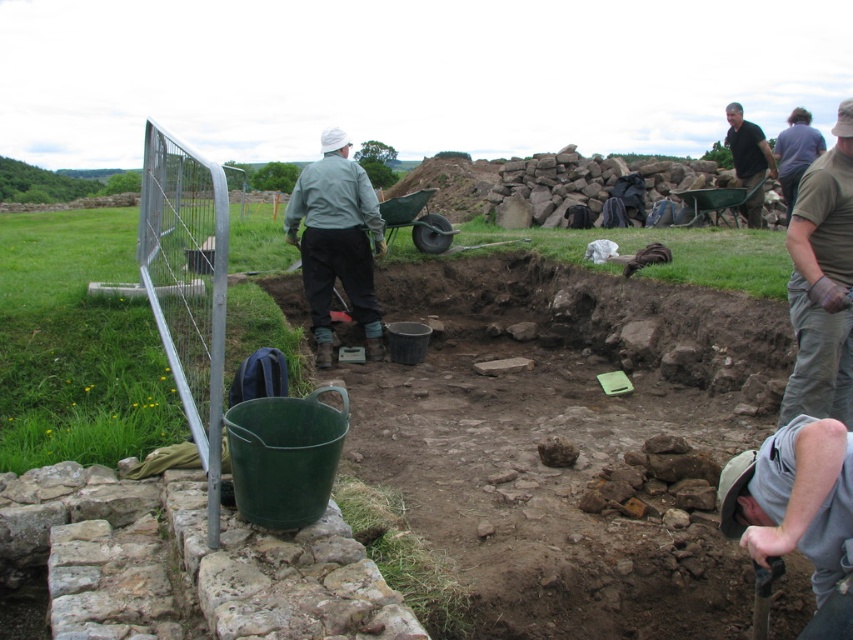
You are a site supervisor at the excavation. You need to ensure that workers maintain a safe distance of at least 30 feet apart due to site safety protocols. Are the gray fabric shirt at lower right and the black cotton shirt at upper right complying with this requirement?

The gray fabric shirt at lower right and the black cotton shirt at upper right are 32.20 feet apart from each other, which exceeds the required 30 feet distance. Therefore, they are complying with the safety protocols.

You are an archaeologist at the excavation site. You need to determine which clothing item is closer to the edge of the pit. Based on the height of the gray fabric shirt at lower right and the light gray fabric jacket at center, can you tell which one is closer?

The gray fabric shirt at lower right is shorter than the light gray fabric jacket at center, so the gray fabric shirt at lower right is closer to the edge of the pit because shorter objects appear closer when viewed from above.